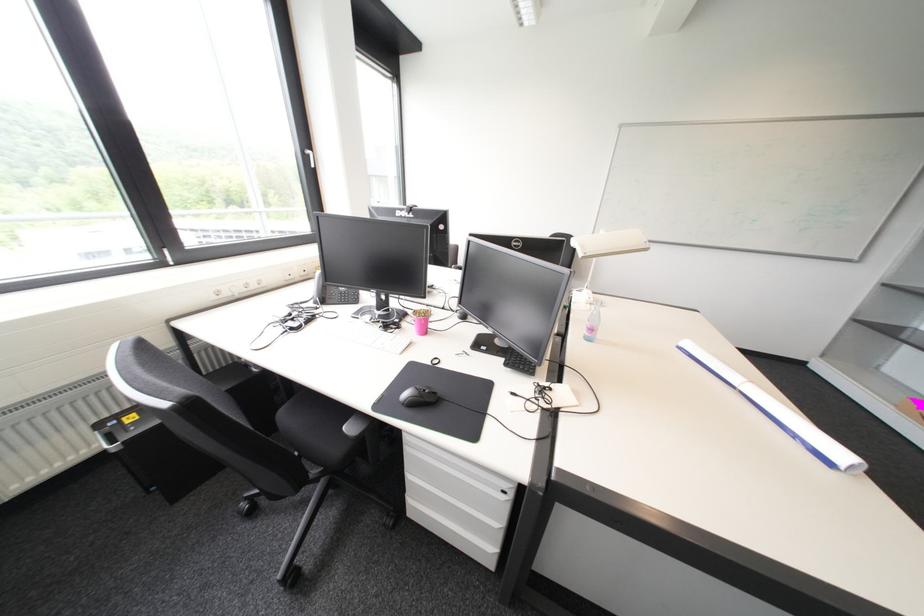
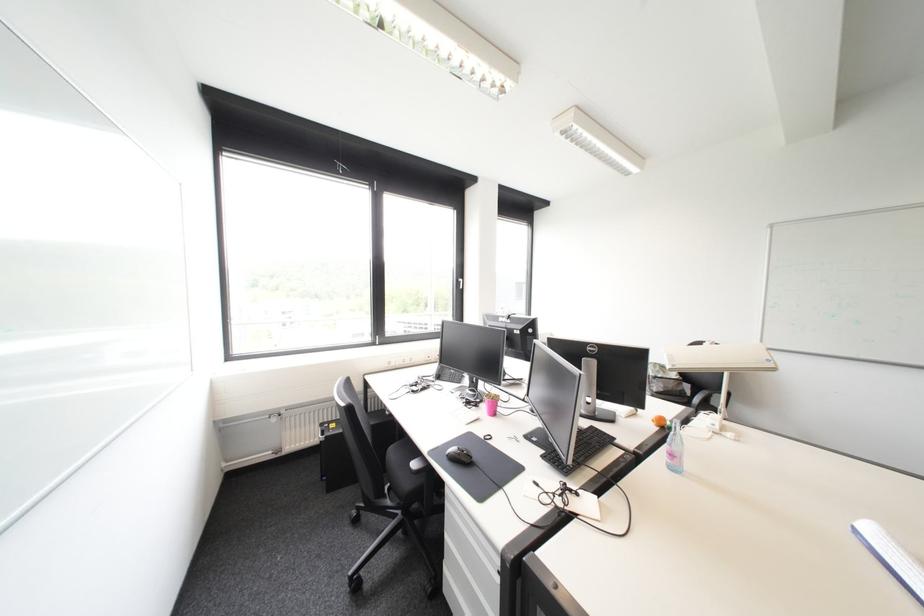
In the second image, find the point that corresponds to point (516, 365) in the first image.

(553, 458)